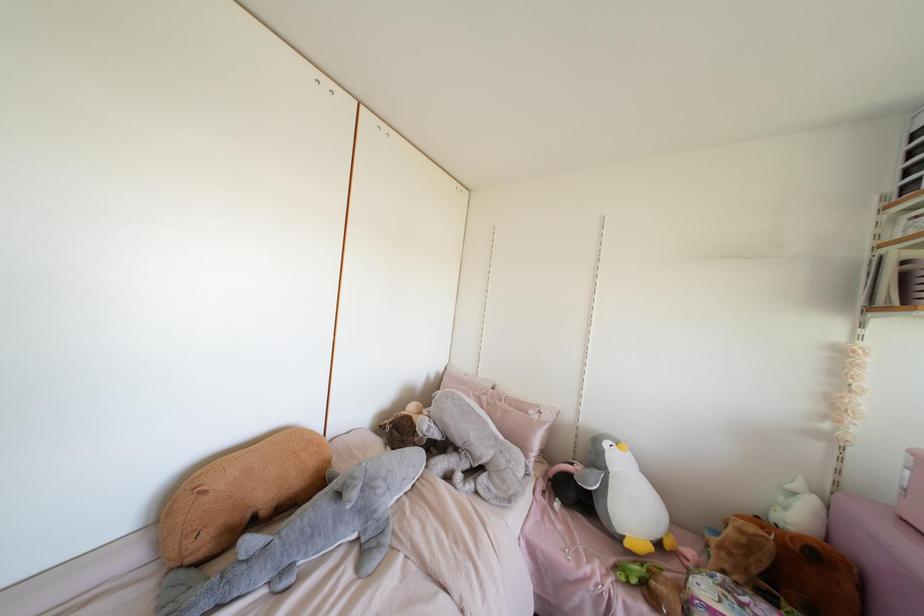
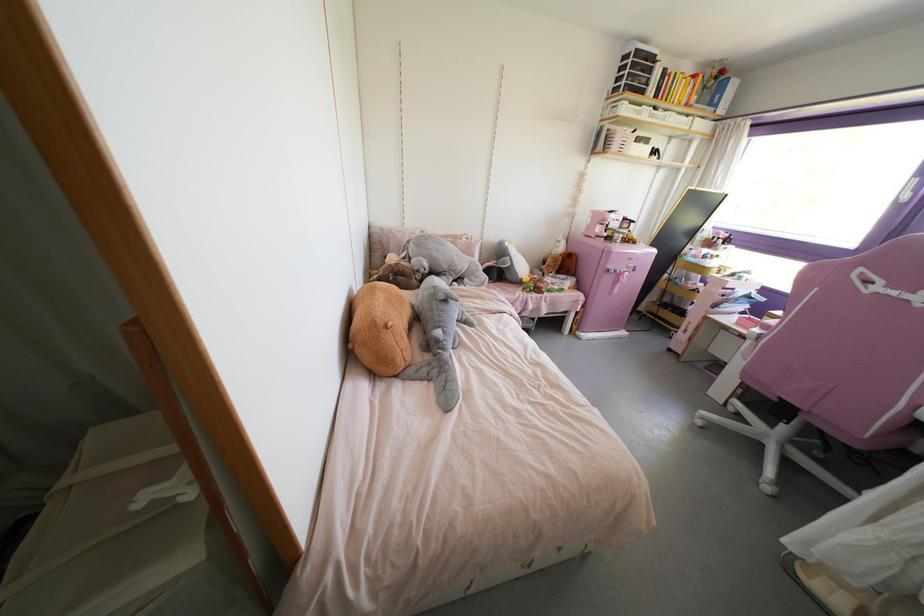
Find the pixel in the second image that matches point (351, 477) in the first image.

(444, 290)